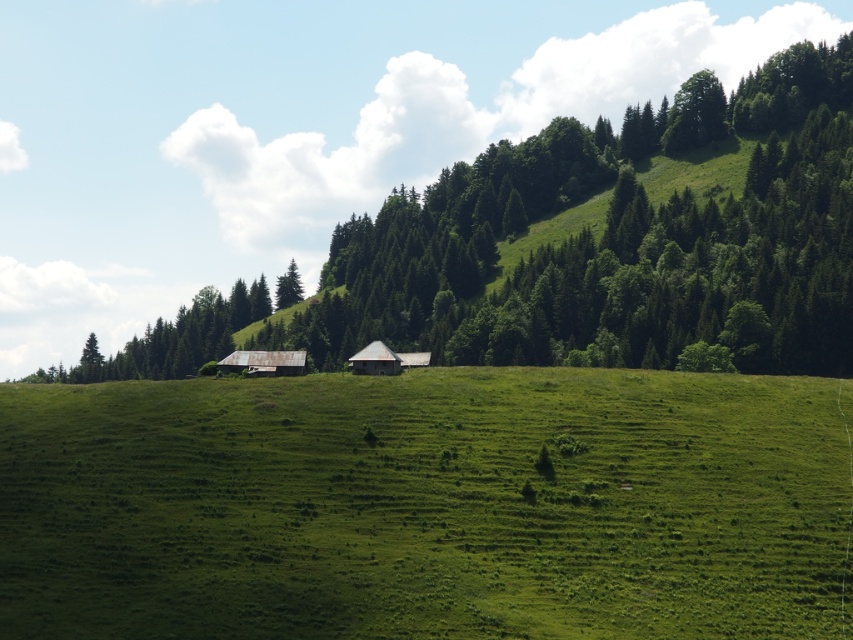
You are standing in the rural landscape and want to take a photo of both the point at coordinates (550, 128) and the point at coordinates (416, 362). Which point should you focus on first to ensure both are in sharp focus?

You should focus on the point at coordinates (550, 128) first because it is closer to the camera than the point at coordinates (416, 362). This ensures that both points will be in focus when using a camera with a fixed focal plane.

You are standing in the middle of the green grassy field at center and want to reach the rusty metal barn at center. Which direction should you move to get closer to the barn?

You should move upward because the green grassy field at center is below the rusty metal barn at center, so moving upward will bring you closer to the barn.

Consider the image. You are standing in the field and want to walk towards the rustic wooden barn at center. Which direction should you walk to avoid the green leafy trees at center first?

You should walk around the green leafy trees at center to reach the rustic wooden barn at center since the trees are closer to you than the barn.